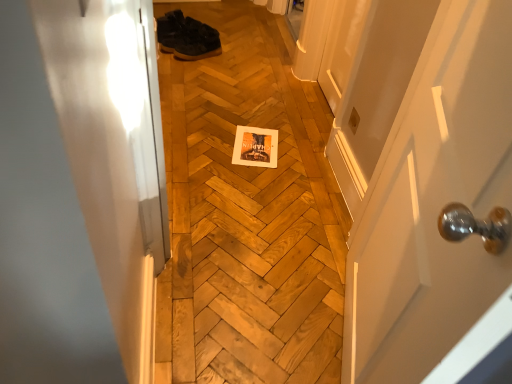
Question: Is the depth of white glossy door at center greater than that of dark brown leather shoes at upper center?

Choices:
 (A) yes
 (B) no

Answer: (B)

Question: Considering the relative sizes of white glossy door at center and dark brown leather shoes at upper center in the image provided, is white glossy door at center bigger than dark brown leather shoes at upper center?

Choices:
 (A) yes
 (B) no

Answer: (A)

Question: Does white glossy door at center have a lesser width compared to dark brown leather shoes at upper center?

Choices:
 (A) no
 (B) yes

Answer: (B)

Question: Is white glossy door at center surrounding dark brown leather shoes at upper center?

Choices:
 (A) yes
 (B) no

Answer: (B)

Question: Is white glossy door at center directly adjacent to dark brown leather shoes at upper center?

Choices:
 (A) no
 (B) yes

Answer: (A)

Question: Is white glossy door at center not within dark brown leather shoes at upper center?

Choices:
 (A) yes
 (B) no

Answer: (A)

Question: Is wooden at center oriented away from dark brown leather shoes at upper center?

Choices:
 (A) no
 (B) yes

Answer: (A)

Question: Considering the relative sizes of wooden at center and dark brown leather shoes at upper center in the image provided, is wooden at center wider than dark brown leather shoes at upper center?

Choices:
 (A) yes
 (B) no

Answer: (A)

Question: Could you tell me if wooden at center is facing dark brown leather shoes at upper center?

Choices:
 (A) yes
 (B) no

Answer: (B)

Question: From the image's perspective, is wooden at center beneath dark brown leather shoes at upper center?

Choices:
 (A) no
 (B) yes

Answer: (B)

Question: Is wooden at center next to dark brown leather shoes at upper center?

Choices:
 (A) yes
 (B) no

Answer: (B)

Question: Can we say wooden at center lies outside dark brown leather shoes at upper center?

Choices:
 (A) no
 (B) yes

Answer: (B)

Question: Is dark brown leather shoes at upper center to the left of white glossy door at center from the viewer's perspective?

Choices:
 (A) no
 (B) yes

Answer: (B)